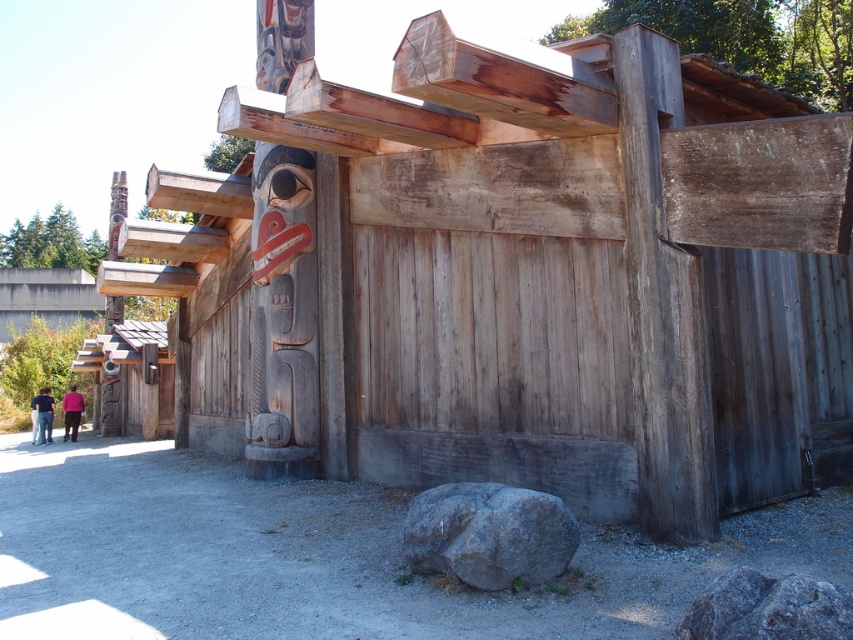
You are an artist planning to sketch the carved wood totem pole at left and the dark blue shirt at lower left. Which object should you focus on first if you want to draw the larger one first?

The carved wood totem pole at left has a larger size compared to the dark blue shirt at lower left, so you should focus on the carved wood totem pole at left first.

You are a sculptor planning to place a new sculpture between the gray rough rock at lower center and the carved wood totem pole at left. Given that the sculpture requires at least 1 meter of space, can you determine if there is enough room based on their widths?

The gray rough rock at lower center is narrower than the carved wood totem pole at left. However, the exact width difference isn not provided, so it is impossible to determine if the combined space between them meets the 1 meter requirement without additional measurements.

You are standing in front of the wooden structure and want to place a small statue on the ground. You have two options for placement spots near the gray rough rock at lower right and the pink fabric at lower left. Which location is closer to you?

The gray rough rock at lower right is in front of the pink fabric at lower left, so placing the statue near the gray rough rock at lower right would be closer to you.